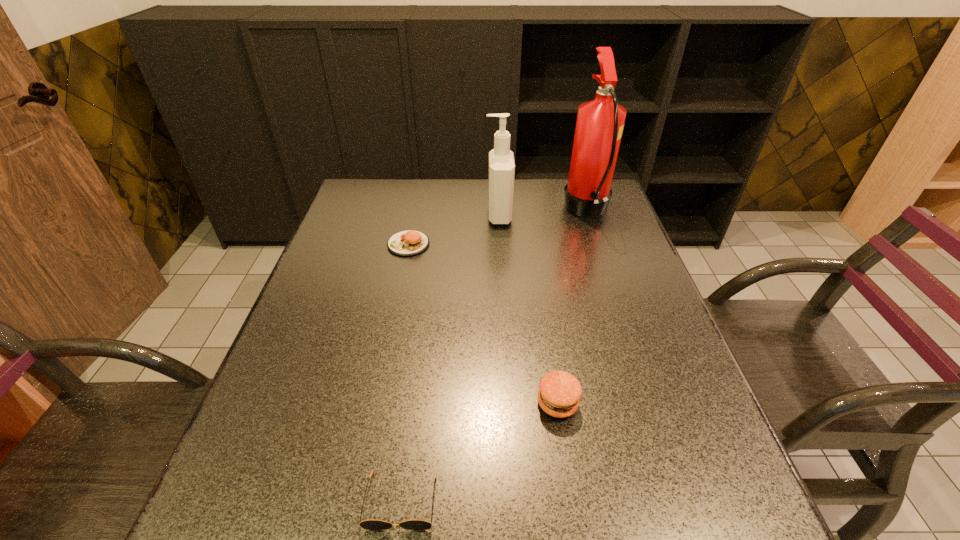
In order to click on object that ranks as the closest to the shorter patty in this screenshot , I will do `click(501, 175)`.

Identify the location of free location that satisfies the following two spatial constraints: 1. on the front label of the second tallest object; 2. on the front-facing side of the nearest object. [515, 501].

This screenshot has width=960, height=540. I want to click on free space that satisfies the following two spatial constraints: 1. at the spray nozzle of the tallest object; 2. on the front-facing side of the sunglasses, so click(x=684, y=501).

Where is `free space that satisfies the following two spatial constraints: 1. on the front label of the cleansing agent; 2. on the front-facing side of the sunglasses`? The width and height of the screenshot is (960, 540). free space that satisfies the following two spatial constraints: 1. on the front label of the cleansing agent; 2. on the front-facing side of the sunglasses is located at coordinates [515, 501].